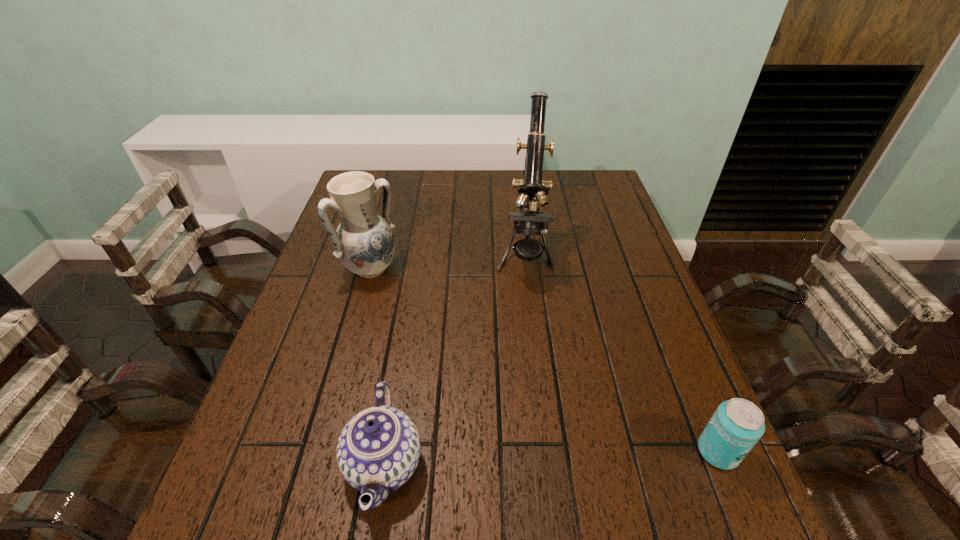
Where is `vacant spot on the desktop that is between the chinaware and the beer can and is positioned through the eyepiece of the tallest object`? The image size is (960, 540). vacant spot on the desktop that is between the chinaware and the beer can and is positioned through the eyepiece of the tallest object is located at coordinates (514, 460).

Identify the location of free space on the desktop that is between the chinaware and the rightmost object and is positioned on either side of the second tallest object. (575, 457).